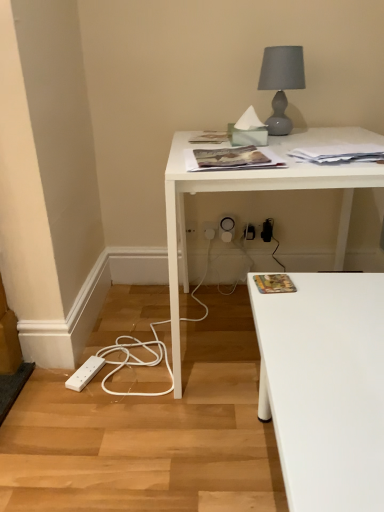
This screenshot has width=384, height=512. In order to click on vacant space behind white plastic extension cord at lower left in this screenshot , I will do pyautogui.click(x=112, y=344).